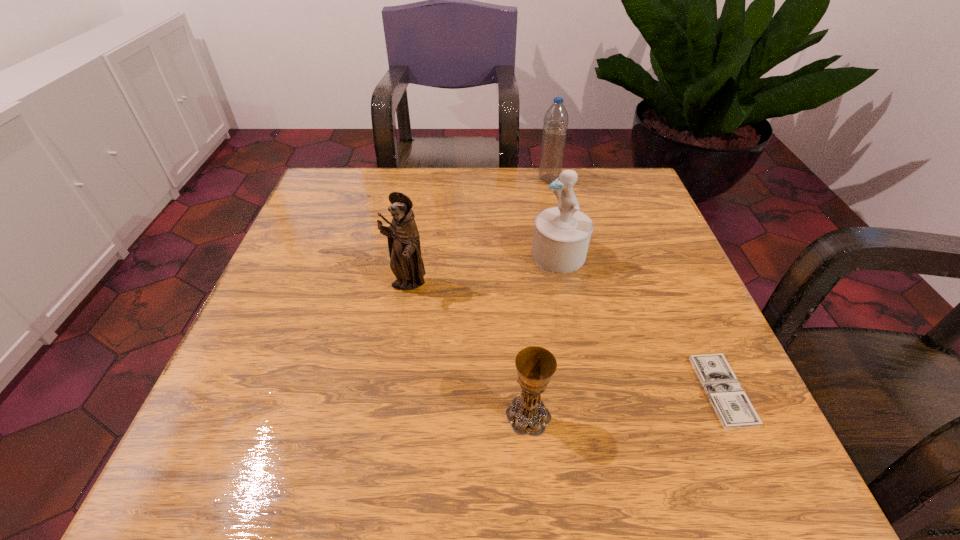
I want to click on vacant area at the near edge, so point(417,441).

Identify the location of blank area at the left edge. click(x=317, y=225).

At what (x,y) coordinates should I click in order to perform the action: click on free space at the right edge of the desktop. Please return your answer as a coordinate pair (x, y). Looking at the image, I should click on (679, 415).

Image resolution: width=960 pixels, height=540 pixels. What are the coordinates of `free space at the near left corner of the desktop` in the screenshot? It's located at (222, 449).

At what (x,y) coordinates should I click in order to perform the action: click on vacant space at the far right corner of the desktop. Please return your answer as a coordinate pair (x, y). Looking at the image, I should click on (611, 191).

Image resolution: width=960 pixels, height=540 pixels. In the image, there is a desktop. Identify the location of free space at the near right corner. (654, 434).

Identify the location of empty location between the shortest object and the left figurine. (564, 338).

The height and width of the screenshot is (540, 960). I want to click on vacant area that lies between the leftmost object and the dollar, so click(564, 338).

This screenshot has height=540, width=960. I want to click on free space between the right figurine and the shortest object, so click(640, 322).

Locate an element on the screen. The height and width of the screenshot is (540, 960). empty location between the farthest object and the dollar is located at coordinates (636, 285).